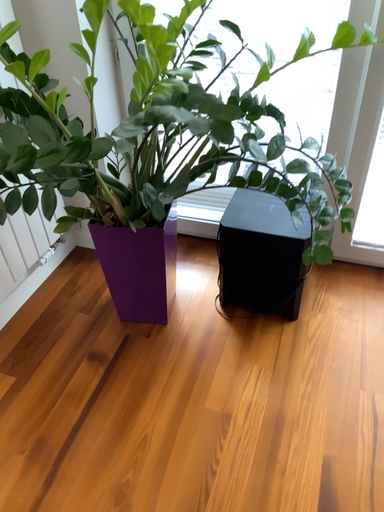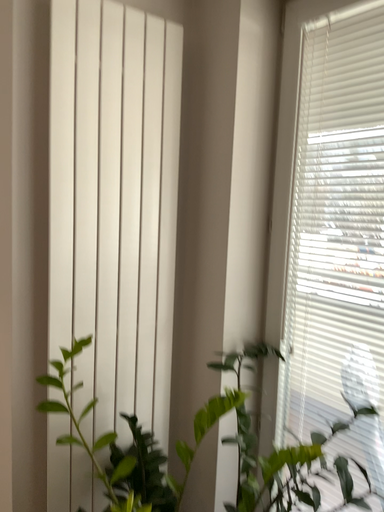
Question: Which way did the camera rotate in the video?

Choices:
 (A) rotated upward
 (B) rotated downward

Answer: (A)